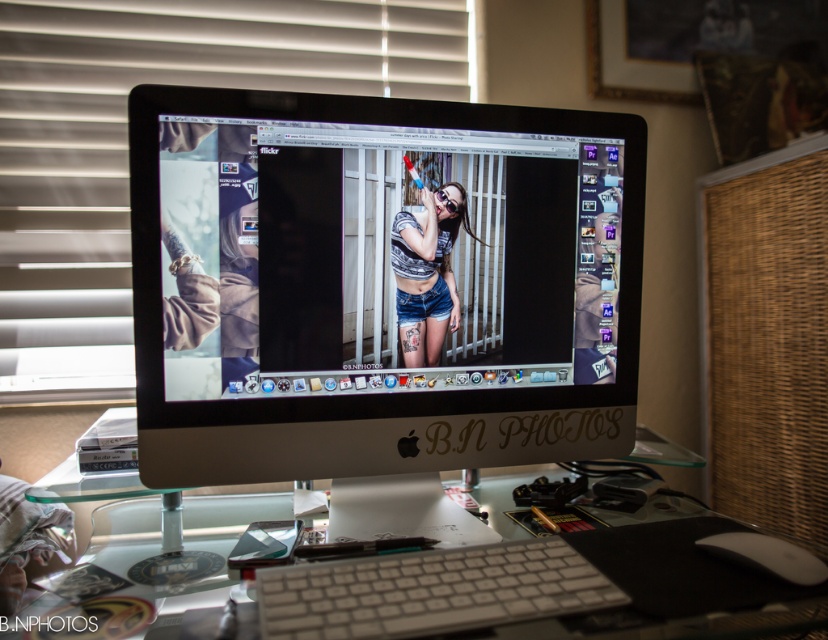
Is satin silver monitor at center to the right of denim shorts at center from the viewer's perspective?

In fact, satin silver monitor at center is to the left of denim shorts at center.

Does point (162, 129) lie behind point (425, 289)?

No, (162, 129) is in front of (425, 289).

The height and width of the screenshot is (640, 828). I want to click on satin silver monitor at center, so click(379, 292).

The height and width of the screenshot is (640, 828). Identify the location of satin silver monitor at center. (379, 292).

Can you confirm if white matte blinds at upper left is positioned above clear glass computer desk at center?

Indeed, white matte blinds at upper left is positioned over clear glass computer desk at center.

Is white matte blinds at upper left to the right of clear glass computer desk at center from the viewer's perspective?

No, white matte blinds at upper left is not to the right of clear glass computer desk at center.

Does point (83, 164) lie in front of point (686, 573)?

No, it is not.

I want to click on white matte blinds at upper left, so click(x=126, y=144).

Who is positioned more to the left, white plastic keyboard at center or clear glass computer desk at center?

Positioned to the left is clear glass computer desk at center.

Between point (489, 545) and point (325, 624), which one is positioned behind?

Positioned behind is point (489, 545).

Which is behind, point (480, 573) or point (579, 540)?

The point (579, 540) is more distant.

You are a GUI agent. You are given a task and a screenshot of the screen. Output one action in this format:
    pyautogui.click(x=<x>, y=<y>)
    Task: Click on the white plastic keyboard at center
    The width and height of the screenshot is (828, 640).
    Given the screenshot: What is the action you would take?
    pyautogui.click(x=431, y=592)